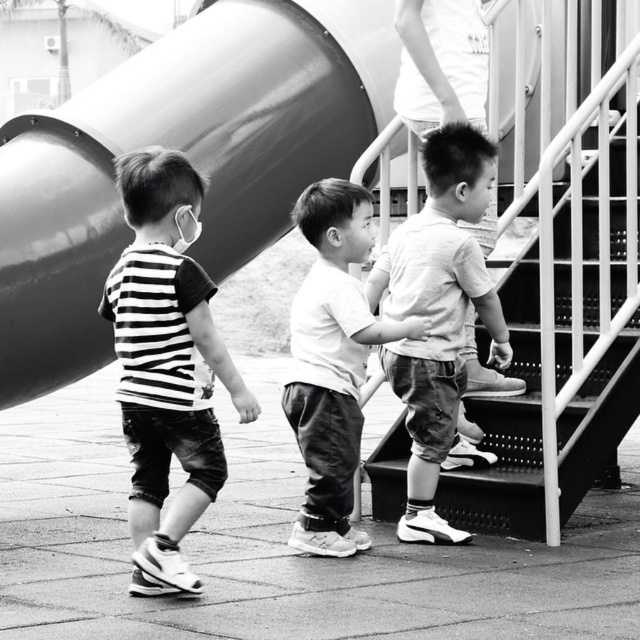
Measure the distance between point (74, 259) and camera.

29.24 feet

Between smooth metal slide at upper left and striped fabric shirt at center, which one has more height?

Standing taller between the two is smooth metal slide at upper left.

Between point (156, 80) and point (168, 192), which one is positioned in front?

Point (168, 192)

Find the location of a particular element. This screenshot has width=640, height=640. smooth metal slide at upper left is located at coordinates (188, 156).

Does light gray cotton shirt at center have a larger size compared to smooth white shirt at center?

Yes, light gray cotton shirt at center is bigger than smooth white shirt at center.

Is light gray cotton shirt at center smaller than smooth white shirt at center?

Incorrect, light gray cotton shirt at center is not smaller in size than smooth white shirt at center.

Measure the distance between point (x=436, y=401) and camera.

Point (x=436, y=401) and camera are 25.99 feet apart.

The image size is (640, 640). In order to click on light gray cotton shirt at center in this screenshot , I will do `click(436, 310)`.

Who is higher up, smooth metal slide at upper left or light gray cotton shirt at center?

smooth metal slide at upper left is higher up.

Does point (209, 243) lie in front of point (428, 470)?

No, (209, 243) is behind (428, 470).

Locate an element on the screen. smooth metal slide at upper left is located at coordinates (188, 156).